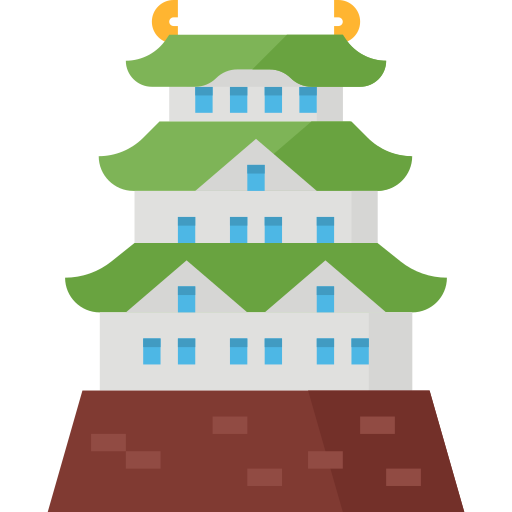
Image resolution: width=512 pixels, height=512 pixels. What are the coordinates of `1st floor windows` in the screenshot? It's located at point(190,294), point(330,304), point(361,357), point(321,352), point(277,352), point(243,357), point(192,354), point(145,355).